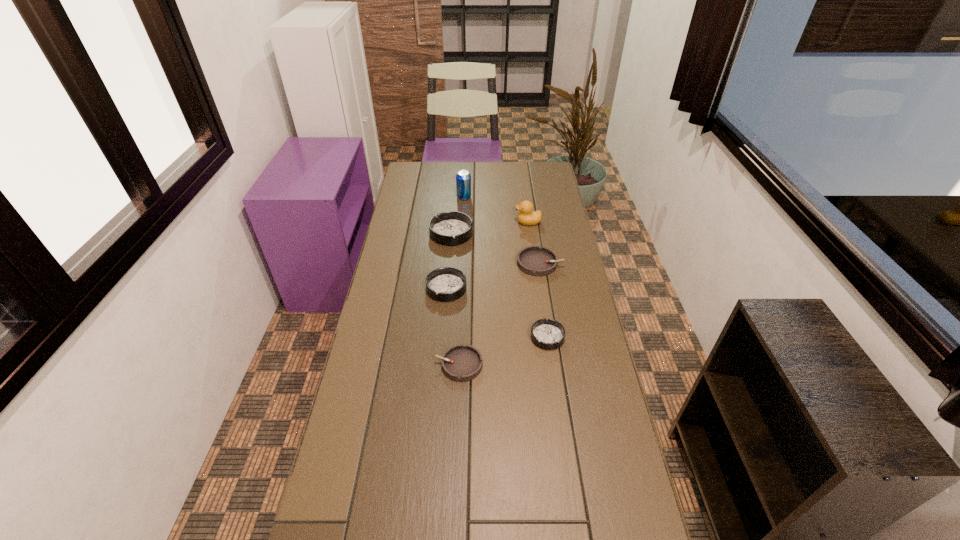
Locate an element on the screen. The image size is (960, 540). free space located on the back of the nearest dark ashtray is located at coordinates (539, 278).

Locate an element on the screen. The height and width of the screenshot is (540, 960). object present at the left edge is located at coordinates (450, 228).

You are a GUI agent. You are given a task and a screenshot of the screen. Output one action in this format:
    pyautogui.click(x=<x>, y=<y>)
    Task: Click on the duckling at the right edge
    This screenshot has height=540, width=960.
    Given the screenshot: What is the action you would take?
    pyautogui.click(x=526, y=216)

Locate an element on the screen. blank space at the far edge of the desktop is located at coordinates (481, 170).

Where is `free space at the left edge of the desktop`? free space at the left edge of the desktop is located at coordinates (420, 190).

Where is `free space at the right edge`? The image size is (960, 540). free space at the right edge is located at coordinates (526, 194).

In the image, there is a desktop. Where is `vacant region at the far right corner`? This screenshot has height=540, width=960. vacant region at the far right corner is located at coordinates (537, 173).

Locate an element on the screen. vacant area that lies between the nearest dark ashtray and the duckling is located at coordinates (538, 280).

Find the location of a particular element. This screenshot has height=540, width=960. vacant space in between the biggest dark ashtray and the duckling is located at coordinates (x=490, y=228).

This screenshot has width=960, height=540. What are the coordinates of `vacant space that is in between the sixth shortest object and the second farthest dark ashtray` in the screenshot? It's located at pos(487,255).